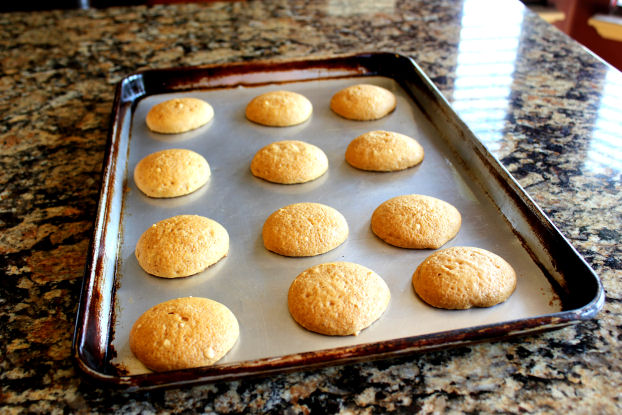
At what (x,y) coordinates should I click in order to perform the action: click on upper left corner of counter. Please return your answer as a coordinate pair (x, y). Image resolution: width=622 pixels, height=415 pixels. Looking at the image, I should click on (6, 4).